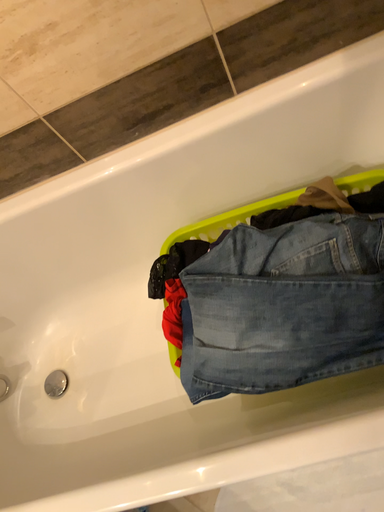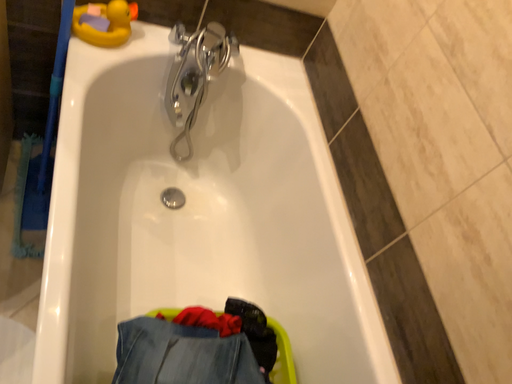
Question: Which way did the camera rotate in the video?

Choices:
 (A) rotated upward
 (B) rotated downward

Answer: (A)